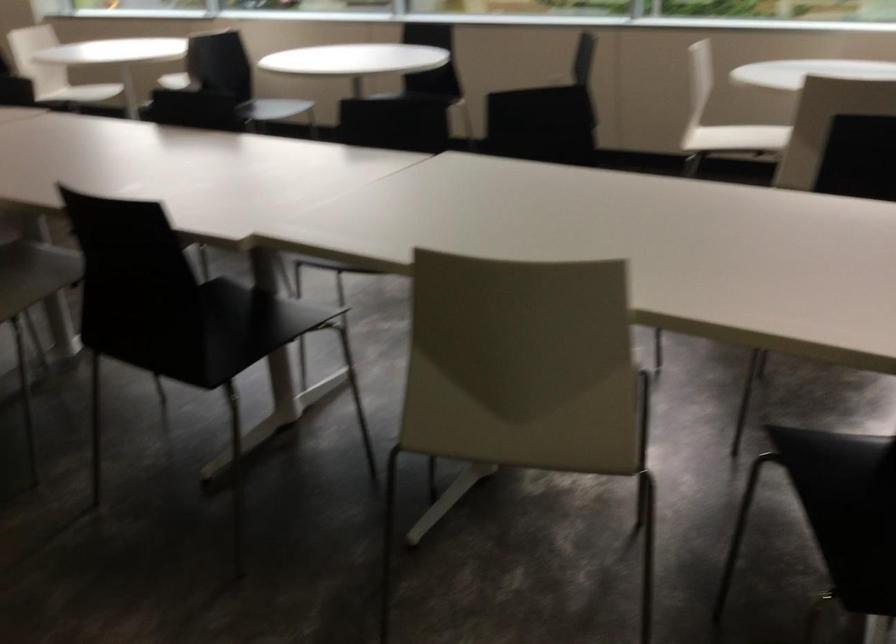
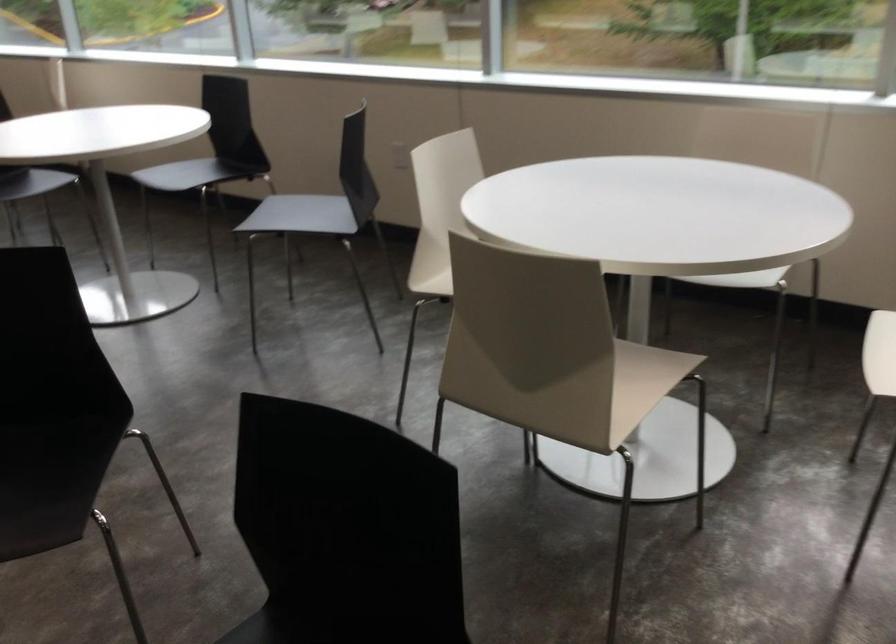
The images are taken continuously from a first-person perspective. In which direction are you moving?

The cameraman moved toward right, forward.